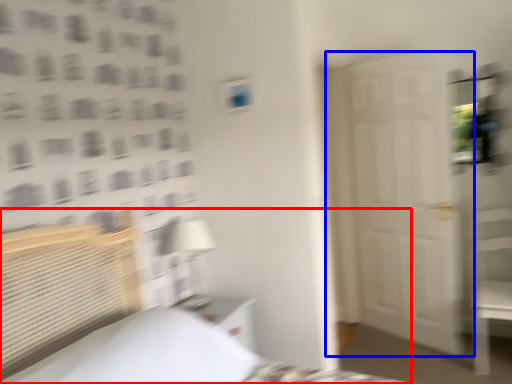
Question: Among these objects, which one is farthest to the camera, bed (highlighted by a red box) or door (highlighted by a blue box)?

Choices:
 (A) bed
 (B) door

Answer: (B)